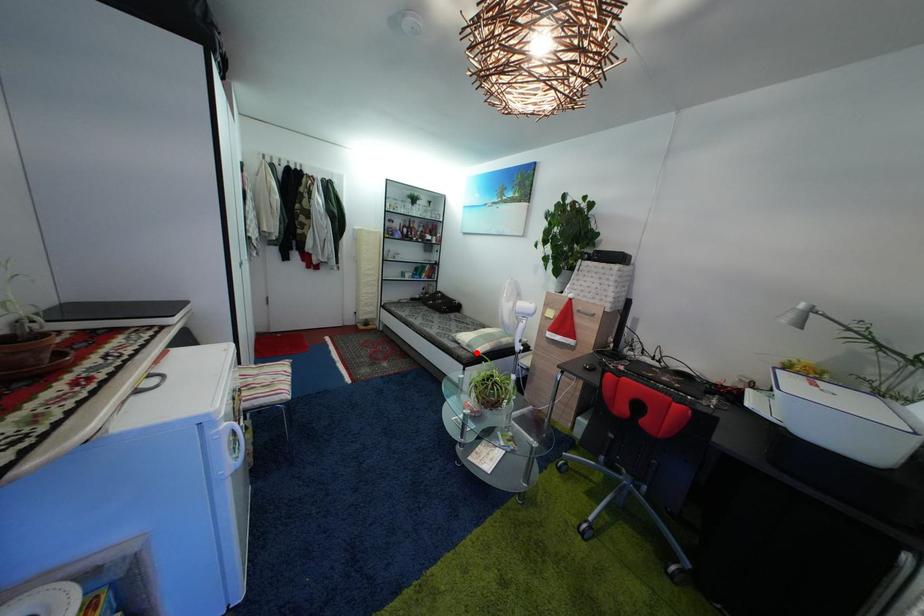
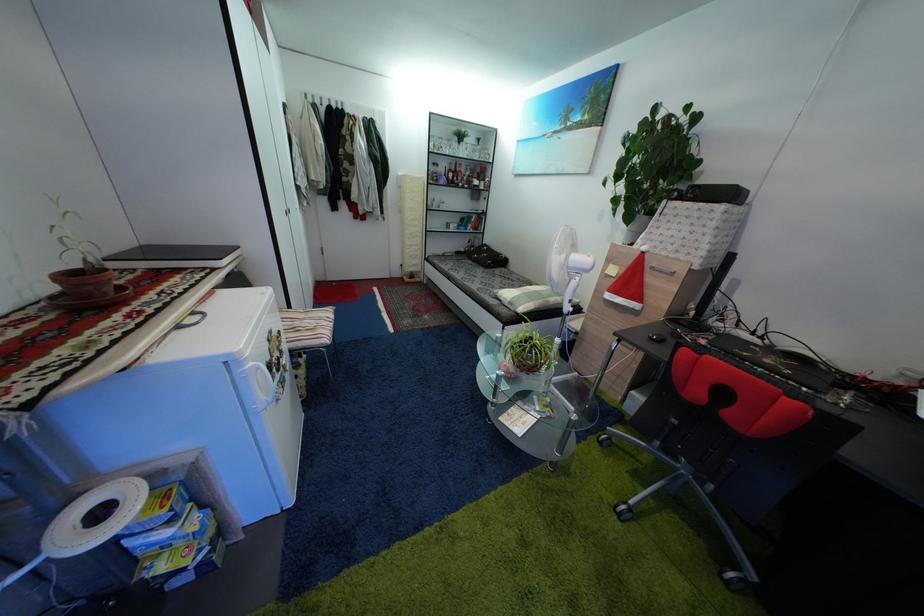
Question: I am providing you with two images of the same scene from different viewpoints. A red point is shown in image1. For the corresponding object point in image2, is it positioned nearer or farther from the camera?

Choices:
 (A) Nearer
 (B) Farther

Answer: (A)